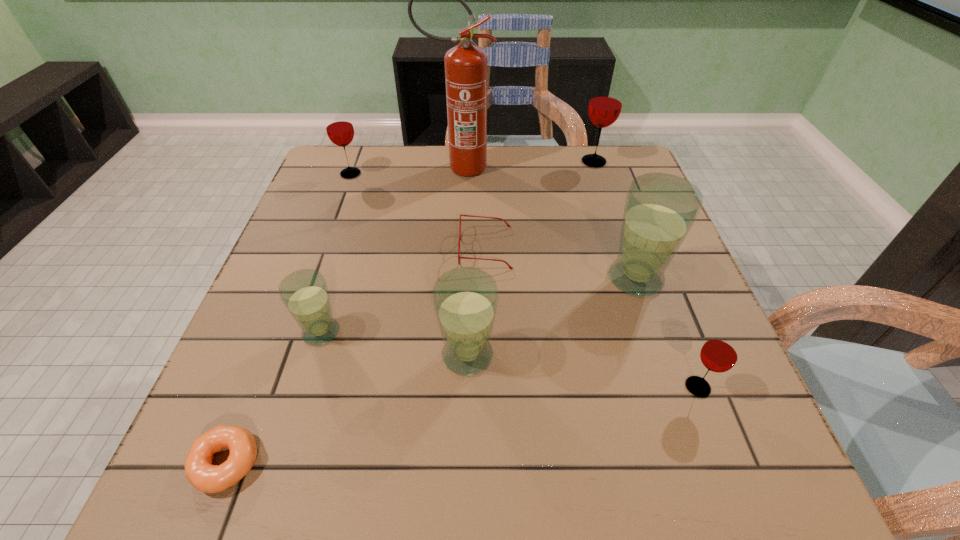
Where is `object located at the far right corner`? object located at the far right corner is located at coordinates (605, 104).

Find the location of a particular element. vacant area at the far edge of the desktop is located at coordinates (505, 157).

In the image, there is a desktop. Identify the location of vacant region at the left edge. (299, 395).

You are a GUI agent. You are given a task and a screenshot of the screen. Output one action in this format:
    pyautogui.click(x=<x>, y=<y>)
    Task: Click on the vacant space at the right edge of the desktop
    The height and width of the screenshot is (540, 960).
    Given the screenshot: What is the action you would take?
    pyautogui.click(x=603, y=194)

This screenshot has height=540, width=960. What are the coordinates of `vacant space at the far left corner` in the screenshot? It's located at (330, 167).

Locate an element on the screen. empty space between the red spectacles and the red fire extinguisher is located at coordinates (472, 208).

Locate an element on the screen. The width and height of the screenshot is (960, 540). free space between the fire extinguisher and the leftmost red glass is located at coordinates (404, 171).

This screenshot has height=540, width=960. I want to click on vacant area that lies between the red fire extinguisher and the biggest red glass, so click(526, 165).

You are a GUI agent. You are given a task and a screenshot of the screen. Output one action in this format:
    pyautogui.click(x=<x>, y=<y>)
    Task: Click on the free spot between the biggest red glass and the shortest object
    
    Given the screenshot: What is the action you would take?
    pyautogui.click(x=410, y=313)

At what (x,y) coordinates should I click in order to perform the action: click on free space that is in between the second biggest blue glass and the biggest blue glass. Please return your answer as a coordinate pair (x, y). This screenshot has width=960, height=540. Looking at the image, I should click on (552, 317).